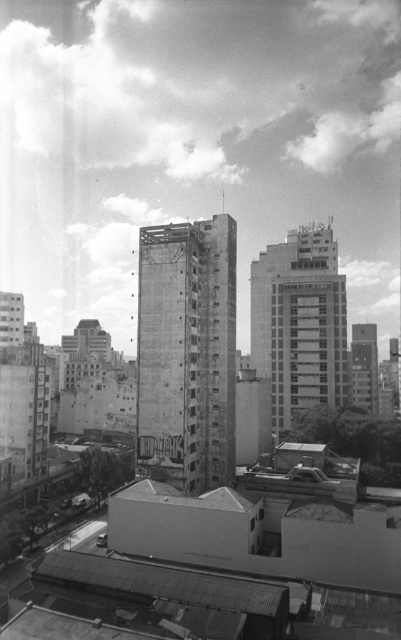
Which of these two, concrete building at center or smooth glass building at center, stands shorter?

With less height is concrete building at center.

Which is behind, point (218, 296) or point (332, 394)?

The point (332, 394) is behind.

Locate an element on the screen. This screenshot has width=401, height=640. concrete building at center is located at coordinates (186, 352).